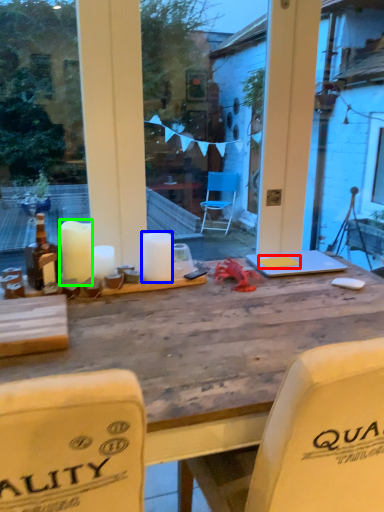
Question: Considering the real-world distances, which object is farthest from notepad (highlighted by a red box)? candle (highlighted by a blue box) or candle (highlighted by a green box)?

Choices:
 (A) candle
 (B) candle

Answer: (B)